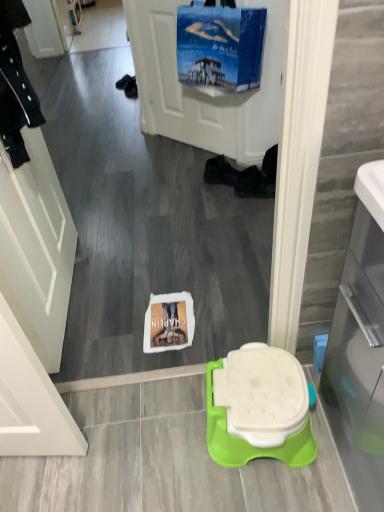
This screenshot has height=512, width=384. I want to click on vacant space that's between white matte screen door at left, arranged as the first screen door when viewed from the front, and black fabric shoe at center, the first footwear viewed from the left, so click(x=132, y=244).